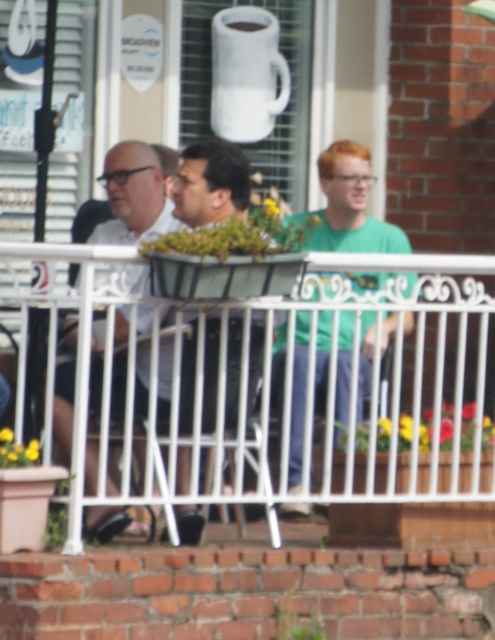
From the picture: Which is above, green matte shirt at center or matte white shirt at center?

Positioned higher is green matte shirt at center.

Is green matte shirt at center in front of matte white shirt at center?

That is False.

Image resolution: width=495 pixels, height=640 pixels. In order to click on green matte shirt at center in this screenshot , I will do `click(350, 205)`.

Does white wrought iron railing at center have a lesser height compared to matte black shirt at center?

No.

Which is behind, point (126, 484) or point (235, 161)?

The point (235, 161) is more distant.

Find the location of `white wrought iron railing at center`. white wrought iron railing at center is located at coordinates (286, 378).

Which is behind, point (335, 234) or point (180, 522)?

The point (335, 234) is behind.

Is green matte shirt at center positioned behind matte black shirt at center?

That is True.

Does point (354, 212) come in front of point (217, 198)?

No.

Locate an element on the screen. The image size is (495, 640). green matte shirt at center is located at coordinates (350, 205).